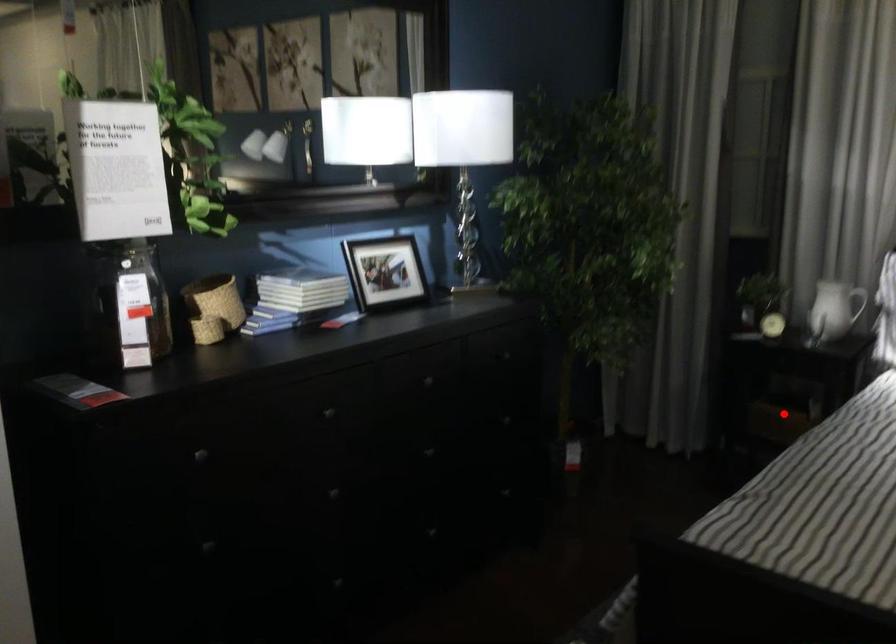
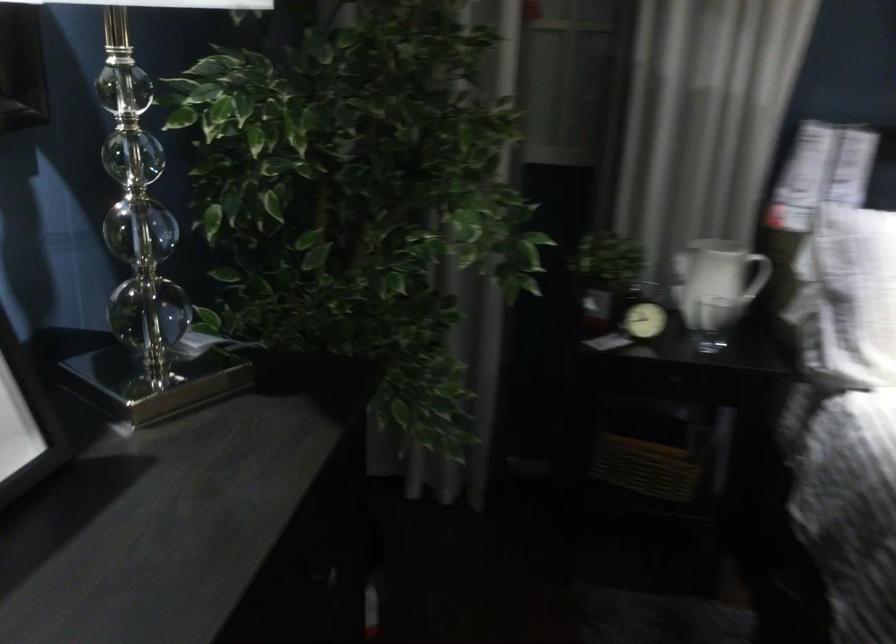
The point at the highlighted location is marked in the first image. Where is the corresponding point in the second image?

(645, 467)